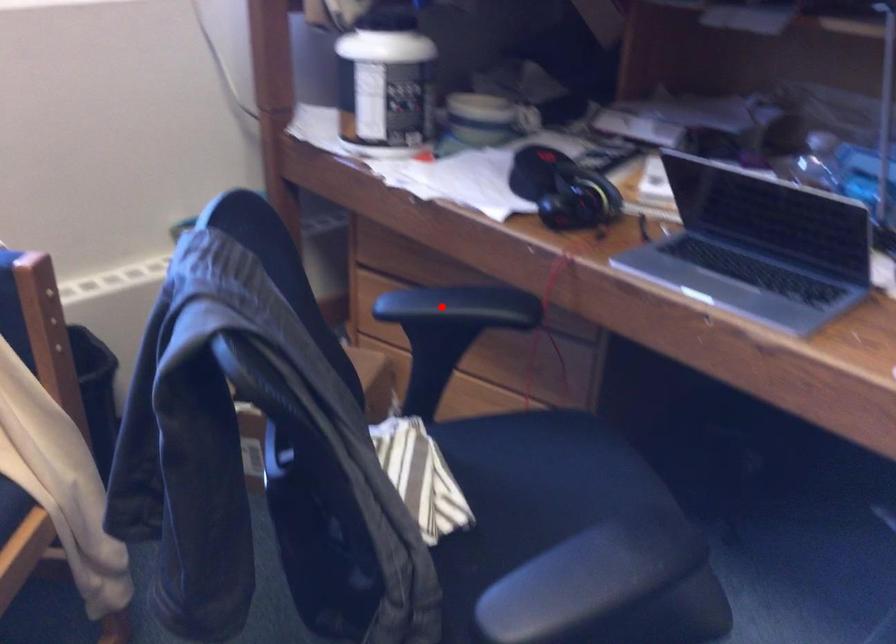
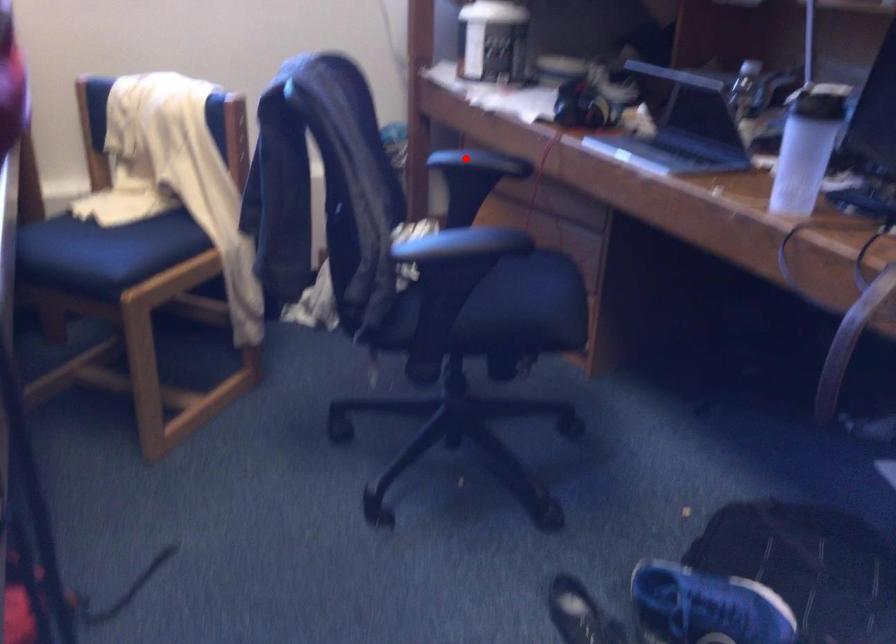
I am providing you with two images of the same scene from different viewpoints. A red point is marked on the first image and another point is marked on the second image. Do the highlighted points in image1 and image2 indicate the same real-world spot?

Yes